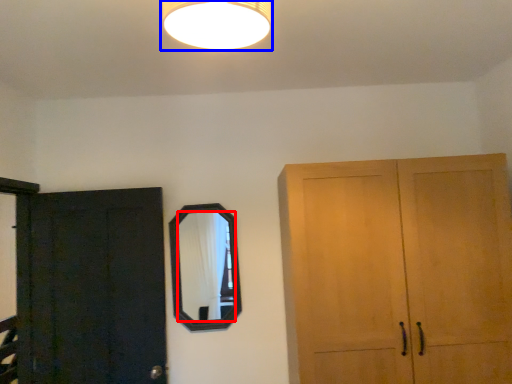
Question: Which object is closer to the camera taking this photo, mirror (highlighted by a red box) or lamp (highlighted by a blue box)?

Choices:
 (A) mirror
 (B) lamp

Answer: (B)